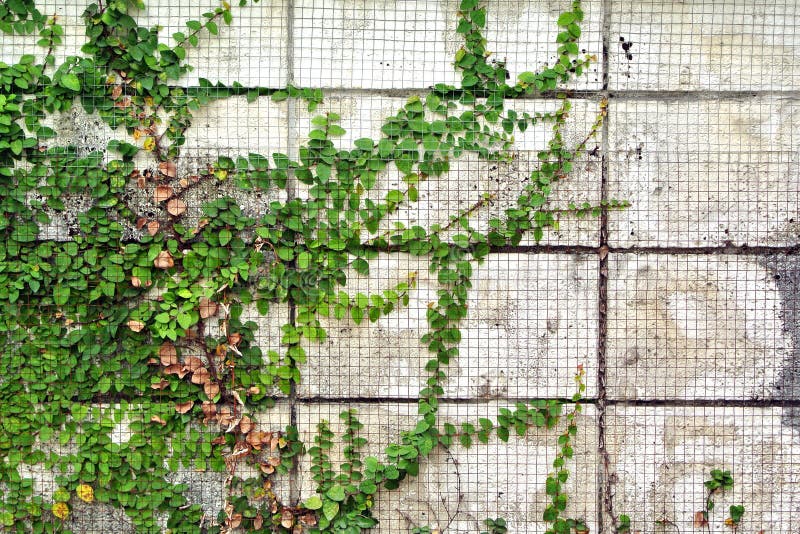
The height and width of the screenshot is (534, 800). What are the coordinates of `grout` in the screenshot? It's located at (602, 398), (606, 245), (604, 95), (289, 121), (290, 42), (605, 26), (722, 96), (721, 250), (712, 403).